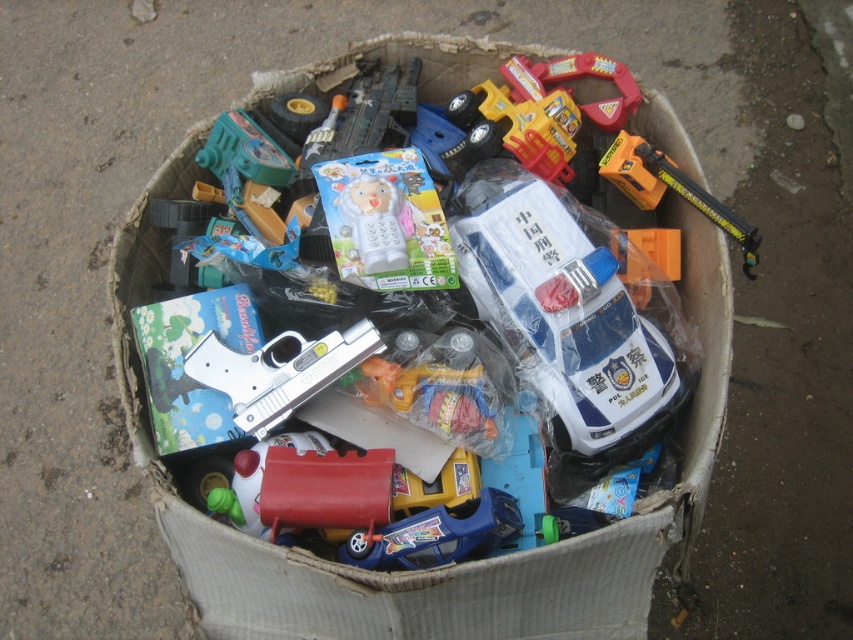
Question: Is white cardboard box at center bigger than orange plastic toy at upper right?

Choices:
 (A) yes
 (B) no

Answer: (A)

Question: Estimate the real-world distances between objects in this image. Which object is farther from the white plastic phone at center?

Choices:
 (A) white plastic police car at center
 (B) orange plastic toy at upper right
 (C) white cardboard box at center
 (D) silver metallic toy gun at center

Answer: (B)

Question: In this image, where is white plastic police car at center located relative to orange plastic toy at upper right?

Choices:
 (A) right
 (B) left

Answer: (B)

Question: Based on their relative distances, which object is farther from the white plastic phone at center?

Choices:
 (A) white plastic police car at center
 (B) silver metallic toy gun at center
 (C) white cardboard box at center
 (D) orange plastic toy at upper right

Answer: (D)

Question: Does silver metallic toy gun at center have a larger size compared to orange plastic toy at upper right?

Choices:
 (A) yes
 (B) no

Answer: (B)

Question: Among these points, which one is nearest to the camera?

Choices:
 (A) (248, 396)
 (B) (680, 552)

Answer: (A)